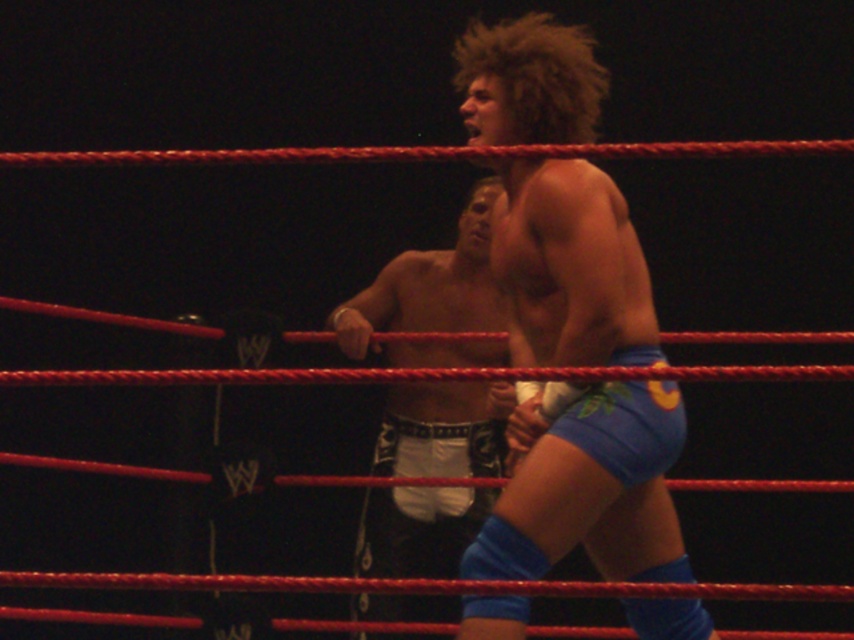
You are a referee in the wrestling ring and need to determine the position of two points marked on the ring floor. The first point is at coordinates point (545,308) and the second is at point (399,536). Based on your observation from the center of the ring, which point is closer to the front edge of the ring?

Point (545,308) is in front of point (399,536), so it is closer to the front edge of the ring.

You are a photographer standing at the center of the wrestling ring. You want to take a photo of the point at coordinates [623,451]. If your camera can focus on objects up to 3 meters away, will it be able to capture that point clearly?

The distance of point [623,451] from the camera is 2.53 meters, which is within the camera focus range of up to 3 meters. Therefore, the camera can capture the point clearly.

You are a referee in the wrestling ring observing the two wrestlers. You need to determine which pair of shorts has a greater width between the blue fabric shorts at center and the white fabric shorts at center. Which one is wider?

The blue fabric shorts at center are wider than the white fabric shorts at center, as stated in the description.